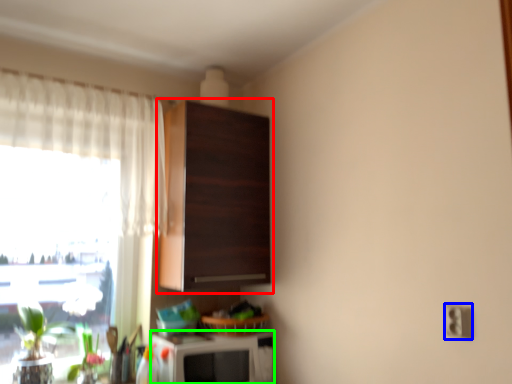
Question: Which object is positioned farthest from cabinetry (highlighted by a red box)? Select from electric outlet (highlighted by a blue box) and appliance (highlighted by a green box).

Choices:
 (A) electric outlet
 (B) appliance

Answer: (A)